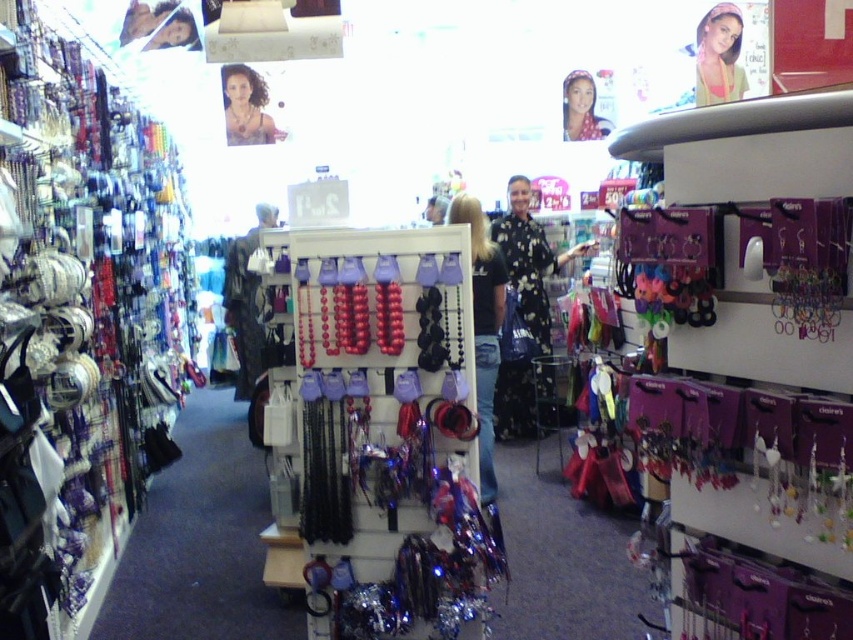
Can you confirm if matte gold necklace at upper center is positioned below matte black hair at upper left?

Yes.

Can you confirm if matte gold necklace at upper center is positioned to the left of matte black hair at upper left?

No, matte gold necklace at upper center is not to the left of matte black hair at upper left.

Measure the distance between point (x=236, y=76) and camera.

Point (x=236, y=76) is 5.56 meters away from camera.

The height and width of the screenshot is (640, 853). In order to click on matte gold necklace at upper center in this screenshot , I will do `click(245, 106)`.

What do you see at coordinates (379, 429) in the screenshot?
I see `shiny metallic beads at center` at bounding box center [379, 429].

Which is in front, point (467, 609) or point (148, 4)?

Point (467, 609) is more forward.

Where is `shiny metallic beads at center`? Image resolution: width=853 pixels, height=640 pixels. shiny metallic beads at center is located at coordinates (379, 429).

Measure the distance between metallic silver necklaces at left and black matte necklace at center.

They are 6.61 feet apart.

Is metallic silver necklaces at left bigger than black matte necklace at center?

Yes.

I want to click on metallic silver necklaces at left, so click(x=80, y=321).